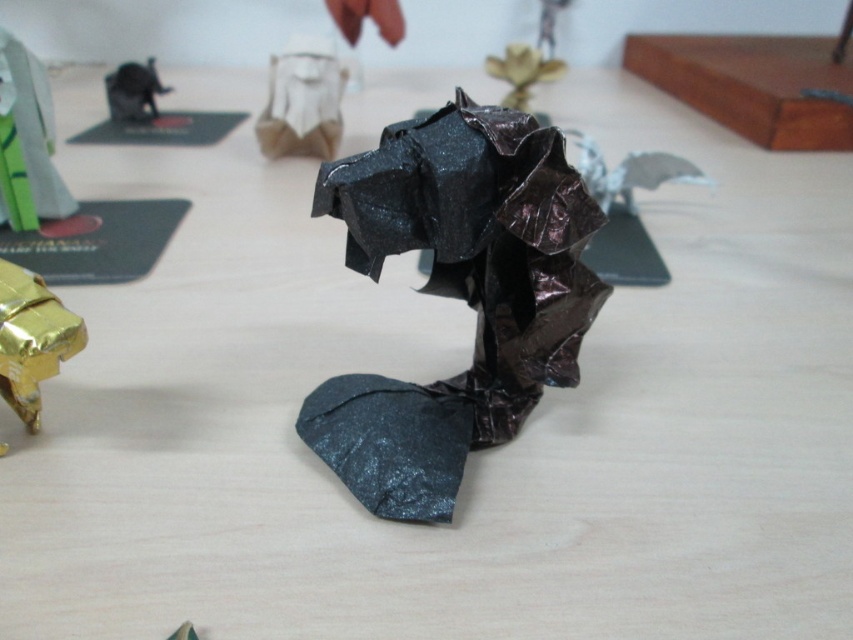
Is shiny black origami elephant at center shorter than metallic gold origami at center?

In fact, shiny black origami elephant at center may be taller than metallic gold origami at center.

Which is in front, point (387, 406) or point (558, 61)?

Point (387, 406)

Locate an element on the screen. This screenshot has height=640, width=853. shiny black origami elephant at center is located at coordinates (457, 296).

Does point (16, 218) come closer to viewer compared to point (36, 323)?

No, it is behind (36, 323).

Find the location of a particular element. matte green paper at upper left is located at coordinates (27, 141).

Who is more distant from viewer, (15, 189) or (7, 317)?

The point (15, 189) is more distant.

Where is `matte green paper at upper left`? The width and height of the screenshot is (853, 640). matte green paper at upper left is located at coordinates (27, 141).

Is gold foil car at lower left shorter than metallic gold origami at center?

Correct, gold foil car at lower left is not as tall as metallic gold origami at center.

Does gold foil car at lower left have a greater width compared to metallic gold origami at center?

No.

Where is `gold foil car at lower left`? The height and width of the screenshot is (640, 853). gold foil car at lower left is located at coordinates (32, 339).